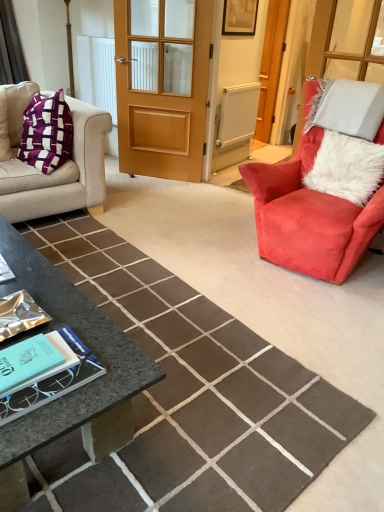
Question: Is the depth of velvet red armchair at right less than that of wooden door at center?

Choices:
 (A) no
 (B) yes

Answer: (B)

Question: Does velvet red armchair at right have a lesser height compared to wooden door at center?

Choices:
 (A) no
 (B) yes

Answer: (B)

Question: Is velvet red armchair at right wider than wooden door at center?

Choices:
 (A) no
 (B) yes

Answer: (B)

Question: Is velvet red armchair at right outside wooden door at center?

Choices:
 (A) no
 (B) yes

Answer: (B)

Question: Considering the relative sizes of velvet red armchair at right and wooden door at center in the image provided, is velvet red armchair at right taller than wooden door at center?

Choices:
 (A) no
 (B) yes

Answer: (A)

Question: Considering the positions of wooden picture frame at upper center and velvet beige couch at left in the image, is wooden picture frame at upper center bigger or smaller than velvet beige couch at left?

Choices:
 (A) small
 (B) big

Answer: (A)

Question: Considering the positions of wooden picture frame at upper center and velvet beige couch at left in the image, is wooden picture frame at upper center wider or thinner than velvet beige couch at left?

Choices:
 (A) thin
 (B) wide

Answer: (A)

Question: Considering the positions of wooden picture frame at upper center and velvet beige couch at left in the image, is wooden picture frame at upper center taller or shorter than velvet beige couch at left?

Choices:
 (A) tall
 (B) short

Answer: (B)

Question: From a real-world perspective, relative to velvet beige couch at left, is wooden picture frame at upper center vertically above or below?

Choices:
 (A) below
 (B) above

Answer: (B)

Question: From the image's perspective, is white fluffy pillow at right located above or below wooden screen door at center?

Choices:
 (A) above
 (B) below

Answer: (B)

Question: Is point (372, 180) closer or farther from the camera than point (269, 46)?

Choices:
 (A) closer
 (B) farther

Answer: (A)

Question: In terms of width, does white fluffy pillow at right look wider or thinner when compared to wooden screen door at center?

Choices:
 (A) thin
 (B) wide

Answer: (B)

Question: Would you say white fluffy pillow at right is inside or outside wooden screen door at center?

Choices:
 (A) outside
 (B) inside

Answer: (A)

Question: Considering the positions of white textured radiator at center and teal matte book at lower left in the image, is white textured radiator at center wider or thinner than teal matte book at lower left?

Choices:
 (A) wide
 (B) thin

Answer: (B)

Question: Is white textured radiator at center taller or shorter than teal matte book at lower left?

Choices:
 (A) tall
 (B) short

Answer: (A)